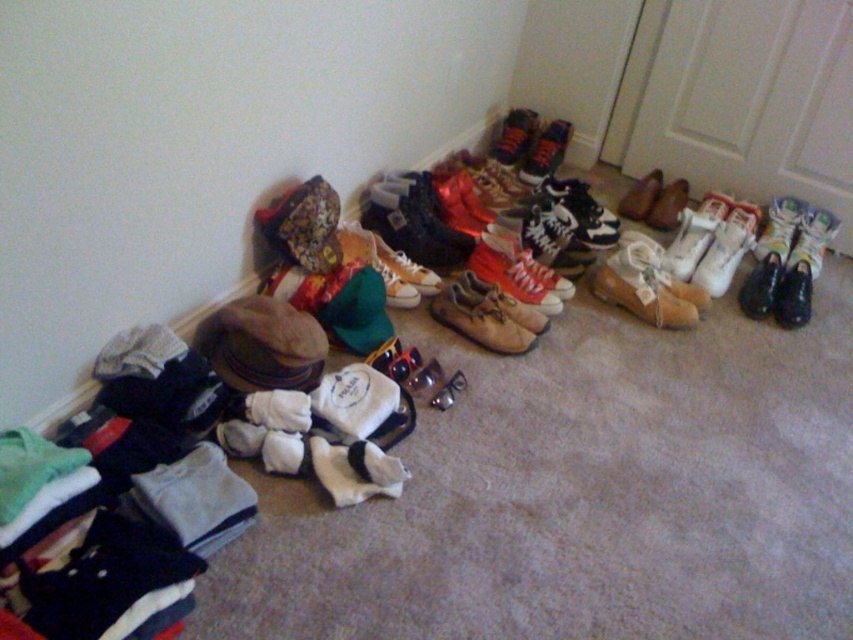
In the scene shown: Is white leather sneaker at upper right thinner than shiny orange sneakers at center?

In fact, white leather sneaker at upper right might be wider than shiny orange sneakers at center.

Between point (811, 252) and point (537, 152), which one is positioned behind?

Positioned behind is point (537, 152).

Is point (805, 262) positioned in front of point (532, 156)?

That is True.

Locate an element on the screen. The image size is (853, 640). white leather sneaker at upper right is located at coordinates (811, 241).

Which of these two, white leather sneaker at upper right or leather sneaker at center, stands shorter?

white leather sneaker at upper right is shorter.

Which is behind, point (805, 248) or point (511, 120)?

Point (511, 120)

Is point (824, 227) in front of point (502, 163)?

Yes.

You are a GUI agent. You are given a task and a screenshot of the screen. Output one action in this format:
    pyautogui.click(x=<x>, y=<y>)
    Task: Click on the white leather sneaker at upper right
    
    Given the screenshot: What is the action you would take?
    pyautogui.click(x=811, y=241)

Who is more distant from viewer, (780, 253) or (628, 218)?

Positioned behind is point (628, 218).

Is white leather sneaker at center right wider than brown suede shoe at center?

Indeed, white leather sneaker at center right has a greater width compared to brown suede shoe at center.

Is point (767, 221) closer to camera compared to point (657, 177)?

Yes, point (767, 221) is closer to viewer.

Where is `white leather sneaker at center right`? This screenshot has width=853, height=640. white leather sneaker at center right is located at coordinates (779, 228).